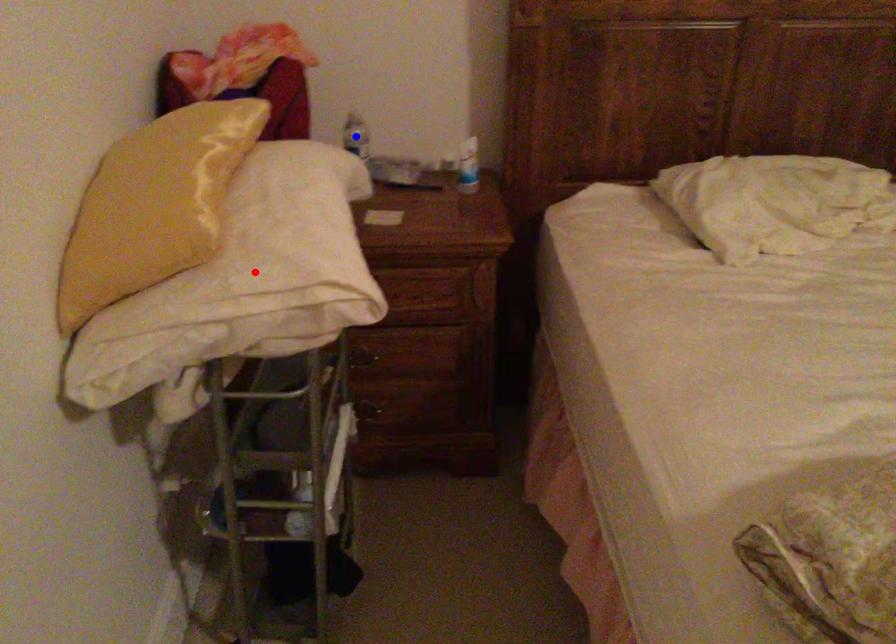
Question: In the image, two points are highlighted. Which point is nearer to the camera? Reply with the corresponding letter.

Choices:
 (A) blue point
 (B) red point

Answer: (B)